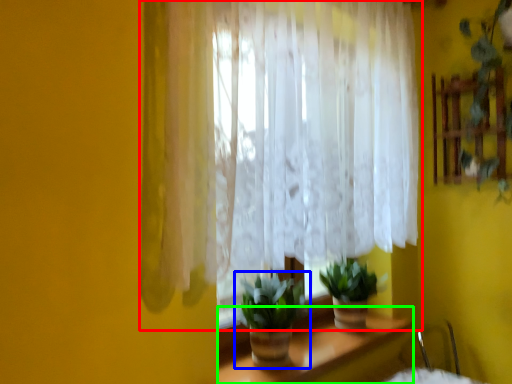
Question: Considering the real-world distances, which object is farthest from curtain (highlighted by a red box)? houseplant (highlighted by a blue box) or table (highlighted by a green box)?

Choices:
 (A) houseplant
 (B) table

Answer: (B)